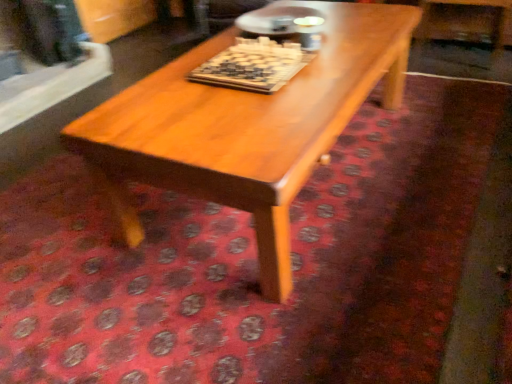
Where is `free spot in front of wooden chessboard at center`? The image size is (512, 384). free spot in front of wooden chessboard at center is located at coordinates (259, 111).